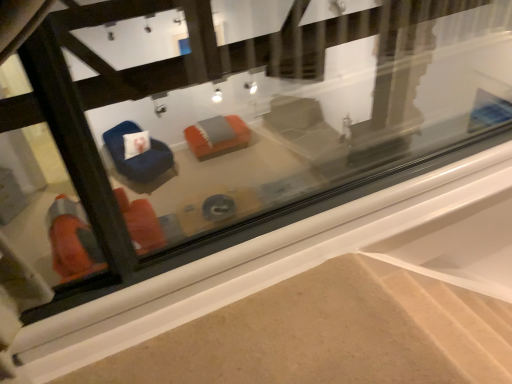
This screenshot has width=512, height=384. Describe the element at coordinates (453, 320) in the screenshot. I see `beige carpeted stairs at lower right` at that location.

Identify the location of beige carpeted stairs at lower right. (453, 320).

Find the location of a particular element. The image size is (512, 384). beige carpeted stairs at lower right is located at coordinates (453, 320).